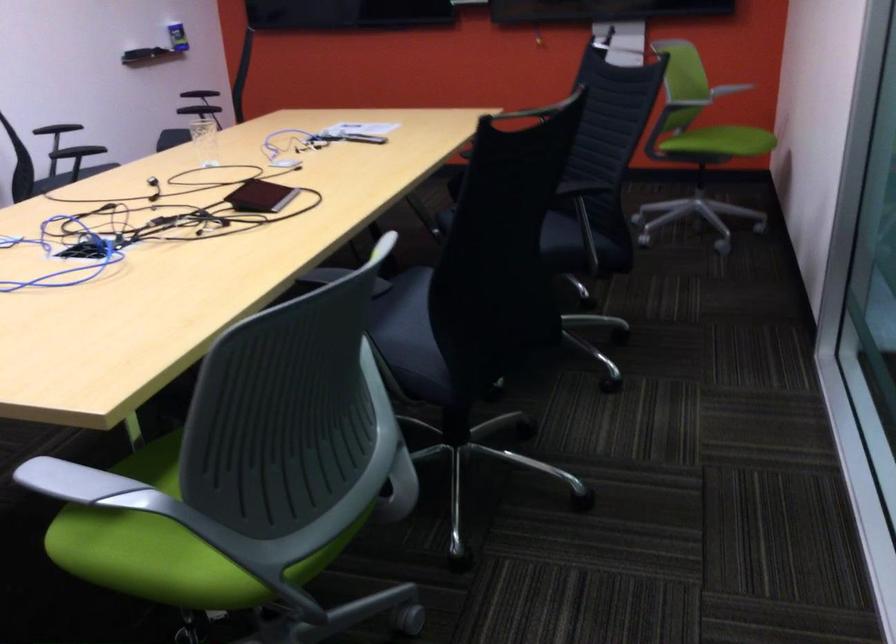
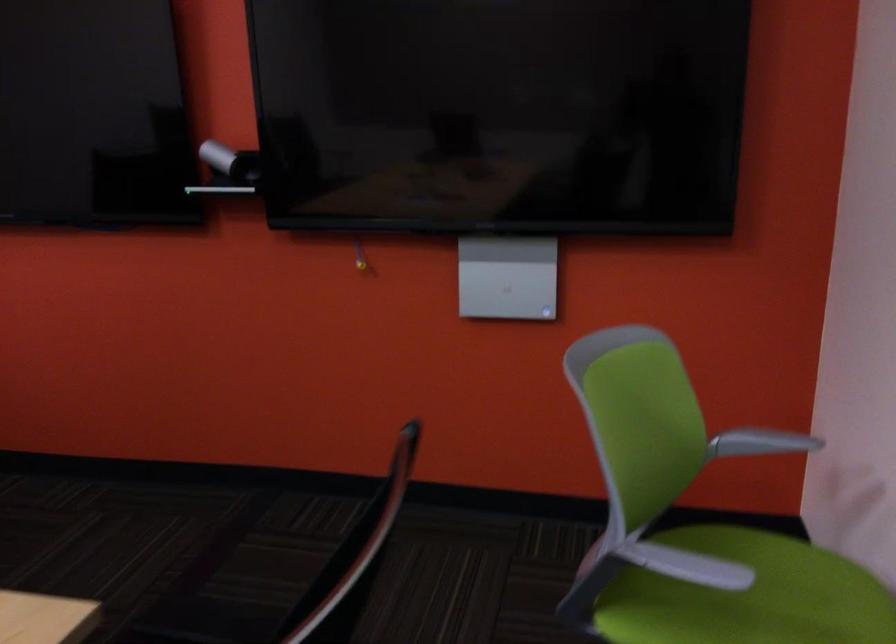
Question: In a continuous first-person perspective shot, in which direction is the camera moving?

Choices:
 (A) Left
 (B) Right
 (C) Forward
 (D) Backward

Answer: (C)